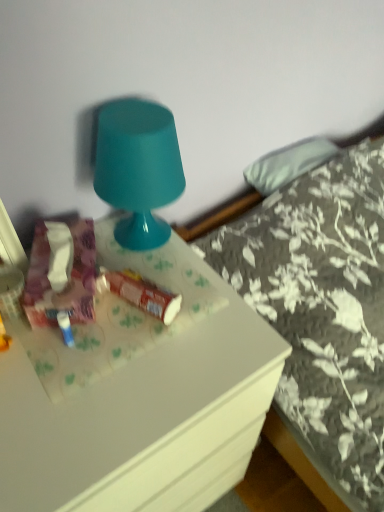
Question: Can you confirm if white glossy desk at center is thinner than glossy plastic lamp at upper center?

Choices:
 (A) yes
 (B) no

Answer: (B)

Question: From the image's perspective, is white glossy desk at center over glossy plastic lamp at upper center?

Choices:
 (A) yes
 (B) no

Answer: (B)

Question: Could you tell me if white glossy desk at center is facing glossy plastic lamp at upper center?

Choices:
 (A) yes
 (B) no

Answer: (B)

Question: Can you confirm if white glossy desk at center is positioned to the right of glossy plastic lamp at upper center?

Choices:
 (A) yes
 (B) no

Answer: (B)

Question: Are white glossy desk at center and glossy plastic lamp at upper center beside each other?

Choices:
 (A) no
 (B) yes

Answer: (A)

Question: Considering the relative positions of matte floral tissue box at left, the second stuff from the right, and matte plastic tube at center, arranged as the first stuff when viewed from the right, in the image provided, is matte floral tissue box at left, the second stuff from the right, to the left or to the right of matte plastic tube at center, arranged as the first stuff when viewed from the right,?

Choices:
 (A) right
 (B) left

Answer: (B)

Question: Is matte floral tissue box at left, the second stuff from the right, inside or outside of matte plastic tube at center, the second stuff when ordered from left to right?

Choices:
 (A) outside
 (B) inside

Answer: (A)

Question: Looking at the image, does matte floral tissue box at left, which appears as the 1th stuff when viewed from the left, seem bigger or smaller compared to matte plastic tube at center, arranged as the first stuff when viewed from the right?

Choices:
 (A) small
 (B) big

Answer: (B)

Question: Is matte floral tissue box at left, which appears as the 1th stuff when viewed from the left, in front of or behind matte plastic tube at center, the second stuff when ordered from left to right, in the image?

Choices:
 (A) behind
 (B) front

Answer: (B)

Question: Is floral fabric bed at upper right taller or shorter than white glossy desk at center?

Choices:
 (A) short
 (B) tall

Answer: (B)

Question: From a real-world perspective, is floral fabric bed at upper right positioned above or below white glossy desk at center?

Choices:
 (A) below
 (B) above

Answer: (B)

Question: Looking at the image, does floral fabric bed at upper right seem bigger or smaller compared to white glossy desk at center?

Choices:
 (A) small
 (B) big

Answer: (B)

Question: Is point (309, 369) closer or farther from the camera than point (91, 375)?

Choices:
 (A) farther
 (B) closer

Answer: (A)

Question: From the image's perspective, is floral fabric bed at upper right positioned above or below matte floral tissue box at left, which appears as the 1th stuff when viewed from the left?

Choices:
 (A) below
 (B) above

Answer: (A)

Question: Considering the positions of floral fabric bed at upper right and matte floral tissue box at left, the second stuff from the right, in the image, is floral fabric bed at upper right wider or thinner than matte floral tissue box at left, the second stuff from the right,?

Choices:
 (A) wide
 (B) thin

Answer: (A)